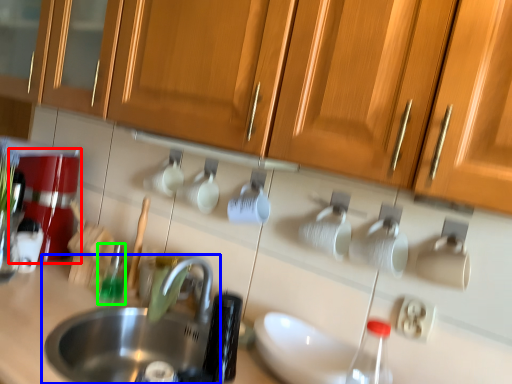
Question: Which object is the farthest from coffee machine (highlighted by a red box)? Choose among these: sink (highlighted by a blue box) or bottle (highlighted by a green box).

Choices:
 (A) sink
 (B) bottle

Answer: (A)